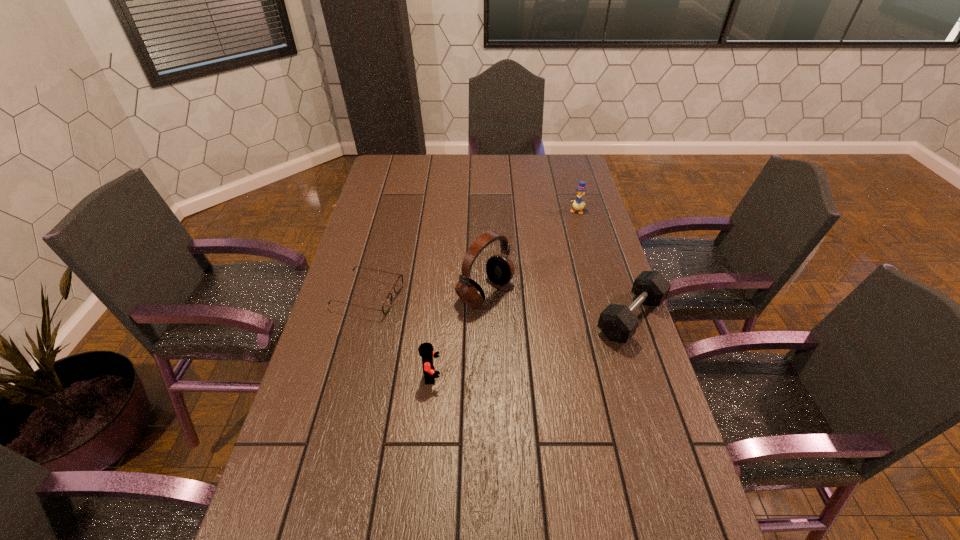
Locate an element on the screen. The width and height of the screenshot is (960, 540). dumbbell that is at the right edge is located at coordinates (618, 323).

You are a GUI agent. You are given a task and a screenshot of the screen. Output one action in this format:
    pyautogui.click(x=<x>, y=<y>)
    Task: Click on the duckling located at the right edge
    The height and width of the screenshot is (540, 960).
    Given the screenshot: What is the action you would take?
    click(578, 204)

The height and width of the screenshot is (540, 960). What are the coordinates of `vacant space at the far edge` in the screenshot? It's located at (427, 180).

In the image, there is a desktop. At what (x,y) coordinates should I click in order to perform the action: click on vacant space at the near edge. Please return your answer as a coordinate pair (x, y). Looking at the image, I should click on (497, 508).

The width and height of the screenshot is (960, 540). In the image, there is a desktop. What are the coordinates of `free space at the left edge` in the screenshot? It's located at (337, 459).

The height and width of the screenshot is (540, 960). Identify the location of vacant space at the right edge of the desktop. (697, 502).

Where is `vacant area that lies between the tallest object and the leftmost object`? The height and width of the screenshot is (540, 960). vacant area that lies between the tallest object and the leftmost object is located at coordinates (427, 294).

The image size is (960, 540). I want to click on empty space between the shortest object and the dumbbell, so click(x=499, y=307).

Find the location of `free spot between the leftmost object and the nearest object`. free spot between the leftmost object and the nearest object is located at coordinates (400, 335).

Image resolution: width=960 pixels, height=540 pixels. Identify the location of empty space between the dumbbell and the headset. (558, 305).